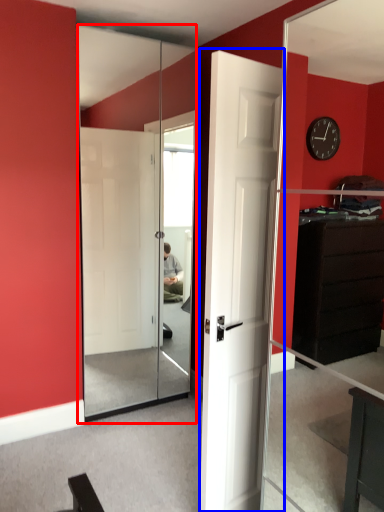
Question: Among these objects, which one is nearest to the camera, screen door (highlighted by a red box) or door (highlighted by a blue box)?

Choices:
 (A) screen door
 (B) door

Answer: (B)